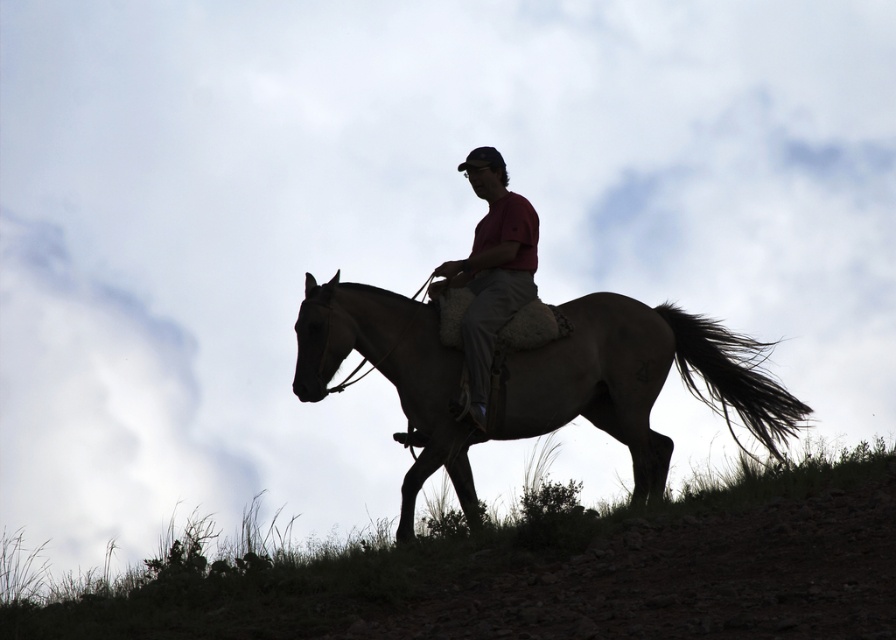
Question: Can you confirm if green grass at lower center is positioned below brown textured horse at center?

Choices:
 (A) no
 (B) yes

Answer: (B)

Question: From the image, what is the correct spatial relationship of green grass at lower center in relation to brown textured horse at center?

Choices:
 (A) above
 (B) below

Answer: (B)

Question: Does brown textured horse at center appear on the right side of matte red shirt at center?

Choices:
 (A) no
 (B) yes

Answer: (B)

Question: Which point is closer to the camera?

Choices:
 (A) matte red shirt at center
 (B) brown textured horse at center
 (C) green grass at lower center

Answer: (C)

Question: Which point appears closest to the camera in this image?

Choices:
 (A) (171, 636)
 (B) (416, 376)
 (C) (435, 291)

Answer: (A)

Question: Which of the following is the closest to the observer?

Choices:
 (A) (522, 355)
 (B) (711, 547)

Answer: (B)